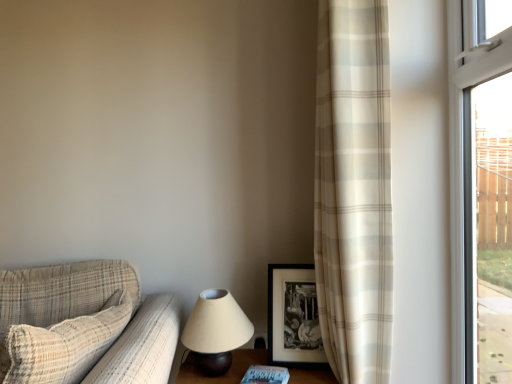
You are a GUI agent. You are given a task and a screenshot of the screen. Output one action in this format:
    pyautogui.click(x=<x>, y=<y>)
    Task: Click on the transparent glass window at right
    
    Given the screenshot: What is the action you would take?
    pyautogui.click(x=481, y=189)

Identify the location of matte beige lampshade at lower center. (216, 331).

Where is `beige plaid curtain at right`? beige plaid curtain at right is located at coordinates (354, 189).

Considering the relative sizes of matte beige lampshade at lower center and beige plaid curtain at right in the image provided, is matte beige lampshade at lower center taller than beige plaid curtain at right?

No.

Which point is more forward, (x=190, y=345) or (x=374, y=325)?

Positioned in front is point (x=374, y=325).

What are the coordinates of `curtain above the matte beige lampshade at lower center (from a real-world perspective)` in the screenshot? It's located at (354, 189).

Can you confirm if matte beige lampshade at lower center is thinner than beige plaid curtain at right?

Correct, the width of matte beige lampshade at lower center is less than that of beige plaid curtain at right.

Looking at their sizes, would you say black matte picture frame at center-right is wider or thinner than matte beige lampshade at lower center?

Clearly, black matte picture frame at center-right has less width compared to matte beige lampshade at lower center.

Considering the relative positions of black matte picture frame at center-right and matte beige lampshade at lower center in the image provided, is black matte picture frame at center-right behind matte beige lampshade at lower center?

Yes, black matte picture frame at center-right is further from the viewer.

Is black matte picture frame at center-right taller than matte beige lampshade at lower center?

Yes, black matte picture frame at center-right is taller than matte beige lampshade at lower center.

Is there a large distance between black matte picture frame at center-right and matte beige lampshade at lower center?

No, black matte picture frame at center-right is in close proximity to matte beige lampshade at lower center.

Can transparent glass window at right be found inside plaid fabric couch at left?

No, transparent glass window at right is not surrounded by plaid fabric couch at left.

Is plaid fabric couch at left placed right next to transparent glass window at right?

No, plaid fabric couch at left is not beside transparent glass window at right.

Which is less distant, (59, 285) or (481, 232)?

Point (59, 285) is farther from the camera than point (481, 232).

Looking at their sizes, would you say transparent glass window at right is wider or thinner than beige plaid curtain at right?

In the image, transparent glass window at right appears to be more narrow than beige plaid curtain at right.

Considering the positions of objects transparent glass window at right and beige plaid curtain at right in the image provided, who is behind, transparent glass window at right or beige plaid curtain at right?

beige plaid curtain at right is more distant.

Is point (457, 350) positioned after point (377, 363)?

No, it is not.

Find the location of a particular element. This screenshot has width=512, height=384. curtain to the right of white matte book at lower center is located at coordinates (354, 189).

Does beige plaid curtain at right have a larger size compared to white matte book at lower center?

Yes, beige plaid curtain at right is bigger than white matte book at lower center.

From the image's perspective, which object appears higher, beige plaid curtain at right or white matte book at lower center?

beige plaid curtain at right is shown above in the image.

Is point (221, 349) closer to camera compared to point (34, 340)?

That is False.

Is matte beige lampshade at lower center bigger or smaller than plaid fabric couch at left?

Clearly, matte beige lampshade at lower center is smaller in size than plaid fabric couch at left.

Is matte beige lampshade at lower center to the left of plaid fabric couch at left from the viewer's perspective?

Incorrect, matte beige lampshade at lower center is not on the left side of plaid fabric couch at left.

In the image, is matte beige lampshade at lower center positioned in front of or behind plaid fabric couch at left?

matte beige lampshade at lower center is behind plaid fabric couch at left.

Based on the photo, is black matte picture frame at center-right aimed at white matte book at lower center?

Yes.

From a real-world perspective, who is located higher, black matte picture frame at center-right or white matte book at lower center?

black matte picture frame at center-right.

Is black matte picture frame at center-right inside or outside of white matte book at lower center?

black matte picture frame at center-right is spatially situated outside white matte book at lower center.

Would you say black matte picture frame at center-right is to the left or to the right of white matte book at lower center in the picture?

Clearly, black matte picture frame at center-right is on the right of white matte book at lower center in the image.

Find the location of a particular element. lamp located below the beige plaid curtain at right (from the image's perspective) is located at coordinates pyautogui.click(x=216, y=331).

The image size is (512, 384). Find the location of `picture frame that is behind the matte beige lampshade at lower center`. picture frame that is behind the matte beige lampshade at lower center is located at coordinates (293, 317).

Which object lies nearer to the anchor point matte beige lampshade at lower center, transparent glass window at right or white matte book at lower center?

white matte book at lower center is closer to matte beige lampshade at lower center.

Considering their positions, is black matte picture frame at center-right positioned closer to beige plaid curtain at right than white matte book at lower center?

black matte picture frame at center-right lies closer to beige plaid curtain at right than the other object.

From the image, which object appears to be nearer to transparent glass window at right, beige plaid curtain at right or white matte book at lower center?

beige plaid curtain at right lies closer to transparent glass window at right than the other object.

Based on the photo, looking at the image, which one is located further to black matte picture frame at center-right, transparent glass window at right or matte beige lampshade at lower center?

transparent glass window at right is further to black matte picture frame at center-right.

Considering their positions, is white matte book at lower center positioned closer to transparent glass window at right than plaid fabric couch at left?

Based on the image, white matte book at lower center appears to be nearer to transparent glass window at right.

Based on their spatial positions, is plaid fabric couch at left or transparent glass window at right further from black matte picture frame at center-right?

transparent glass window at right.

From the image, which object appears to be farther from transparent glass window at right, plaid fabric couch at left or matte beige lampshade at lower center?

plaid fabric couch at left lies further to transparent glass window at right than the other object.

Estimate the real-world distances between objects in this image. Which object is closer to transparent glass window at right, black matte picture frame at center-right or matte beige lampshade at lower center?

The object closer to transparent glass window at right is black matte picture frame at center-right.

This screenshot has width=512, height=384. Find the location of `book between plaid fabric couch at left and matte beige lampshade at lower center along the z-axis`. book between plaid fabric couch at left and matte beige lampshade at lower center along the z-axis is located at coordinates (266, 375).

The height and width of the screenshot is (384, 512). What are the coordinates of `lamp between plaid fabric couch at left and transparent glass window at right from left to right` in the screenshot? It's located at (216, 331).

Identify the location of book between plaid fabric couch at left and transparent glass window at right from left to right. The image size is (512, 384). (266, 375).

Where is `picture frame between beige plaid curtain at right and white matte book at lower center vertically`? This screenshot has width=512, height=384. picture frame between beige plaid curtain at right and white matte book at lower center vertically is located at coordinates (293, 317).